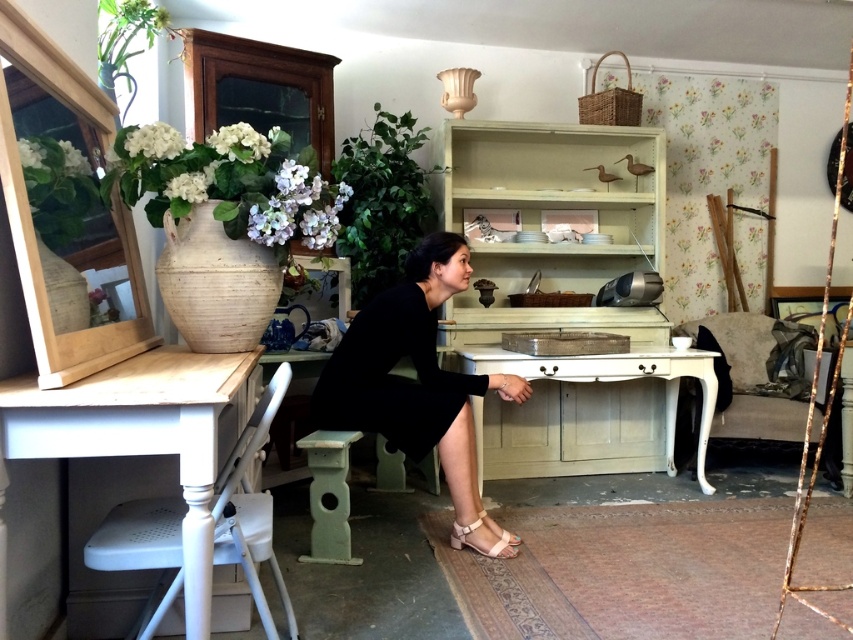
You are a guest in this room and want to sit on the velvet beige sofa at right. However, there is a black matte dress at center in the way. Can you walk around it to reach the sofa?

The black matte dress at center is located above the velvet beige sofa at right, meaning it is hanging or placed on a higher surface. Since it is above the sofa, you can easily walk around the sofa without obstruction from the dress.

You are standing in the room and see two points marked in the image. Which point is closer to you, point (733, 368) or point (469, 532)?

Point (733, 368) is closer to you because it is further to the camera than point (469, 532).

What are the coordinates of the black matte dress at center?

The coordinates of the black matte dress at center are at point (416, 371).